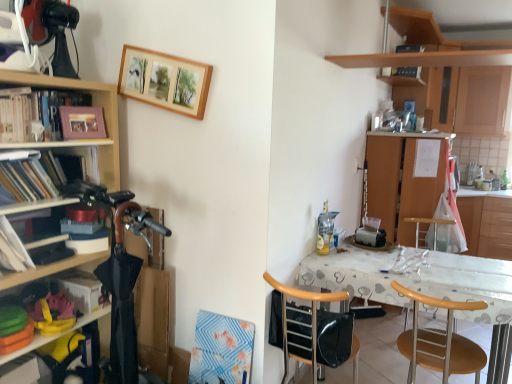
Question: Can you confirm if wooden at right, the first chair in the right-to-left sequence, is smaller than white paper at left, the 2th book positioned from the bottom?

Choices:
 (A) yes
 (B) no

Answer: (B)

Question: From a real-world perspective, is wooden at right, the first chair in the right-to-left sequence, physically above white paper at left, the first book viewed from the front?

Choices:
 (A) yes
 (B) no

Answer: (B)

Question: Is wooden at right, the second chair when ordered from left to right, behind white paper at left, the first book from the top?

Choices:
 (A) yes
 (B) no

Answer: (A)

Question: Considering the relative sizes of wooden at right, the second chair when ordered from left to right, and white paper at left, the first book from the top, in the image provided, is wooden at right, the second chair when ordered from left to right, shorter than white paper at left, the first book from the top,?

Choices:
 (A) no
 (B) yes

Answer: (A)

Question: Is wooden at right, the first chair in the right-to-left sequence, thinner than white paper at left, the first book from the top?

Choices:
 (A) yes
 (B) no

Answer: (B)

Question: From the image's perspective, relative to wooden at right, the first chair in the right-to-left sequence, is matte wooden picture frame at upper left, the second picture frame in the top-to-bottom sequence, above or below?

Choices:
 (A) below
 (B) above

Answer: (B)

Question: Based on their sizes in the image, would you say matte wooden picture frame at upper left, which appears as the 2th picture frame when viewed from the right, is bigger or smaller than wooden at right, the first chair in the right-to-left sequence?

Choices:
 (A) small
 (B) big

Answer: (A)

Question: In the image, is matte wooden picture frame at upper left, the second picture frame in the top-to-bottom sequence, positioned in front of or behind wooden at right, the first chair in the right-to-left sequence?

Choices:
 (A) behind
 (B) front

Answer: (A)

Question: In the image, is matte wooden picture frame at upper left, which appears as the 2th picture frame when viewed from the right, on the left side or the right side of wooden at right, the first chair in the right-to-left sequence?

Choices:
 (A) left
 (B) right

Answer: (A)

Question: Considering the positions of point click(79, 301) and point click(435, 231), is point click(79, 301) closer or farther from the camera than point click(435, 231)?

Choices:
 (A) closer
 (B) farther

Answer: (A)

Question: Is matte black book at left, which is the 1th book in bottom-to-top order, in front of or behind wooden bar stool at center in the image?

Choices:
 (A) behind
 (B) front

Answer: (B)

Question: Is matte black book at left, which is the 1th book in back-to-front order, taller or shorter than wooden bar stool at center?

Choices:
 (A) short
 (B) tall

Answer: (A)

Question: From a real-world perspective, is matte black book at left, which is the 1th book in bottom-to-top order, positioned above or below wooden bar stool at center?

Choices:
 (A) above
 (B) below

Answer: (A)

Question: Does point (91, 119) appear closer or farther from the camera than point (476, 253)?

Choices:
 (A) farther
 (B) closer

Answer: (B)

Question: Based on their sizes in the image, would you say matte wooden picture frame at upper left, the second picture frame in the top-to-bottom sequence, is bigger or smaller than wooden cabinet at right, the 1th cabinetry from the right?

Choices:
 (A) small
 (B) big

Answer: (A)